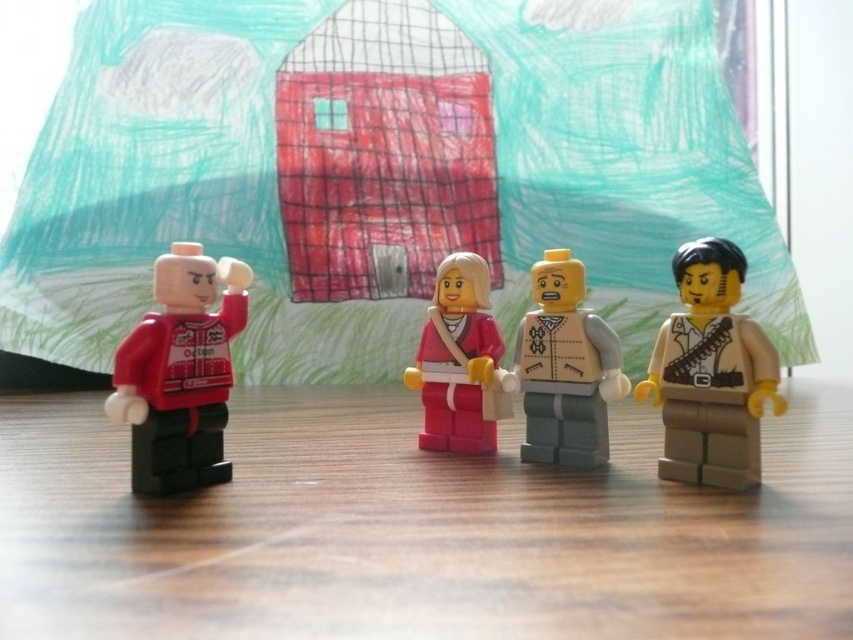
Does point (227, 531) come behind point (488, 300)?

No, it is in front of (488, 300).

Can you confirm if wooden table at lower center is shorter than pink matte figure at center?

Yes.

Describe the element at coordinates (418, 529) in the screenshot. I see `wooden table at lower center` at that location.

Locate an element on the screen. The image size is (853, 640). wooden table at lower center is located at coordinates (418, 529).

Can you confirm if wooden table at lower center is thinner than light gray plastic minifigure at center?

No.

Does point (397, 561) come behind point (590, 337)?

No, it is not.

Find the location of a particular element. The height and width of the screenshot is (640, 853). wooden table at lower center is located at coordinates (418, 529).

In the scene shown: Does matte red minifigure at left have a larger size compared to light gray plastic minifigure at center?

Correct, matte red minifigure at left is larger in size than light gray plastic minifigure at center.

Does matte red minifigure at left lie behind light gray plastic minifigure at center?

No.

Between point (236, 273) and point (532, 344), which one is positioned in front?

Point (236, 273) is in front.

Identify the location of matte red minifigure at left. (180, 372).